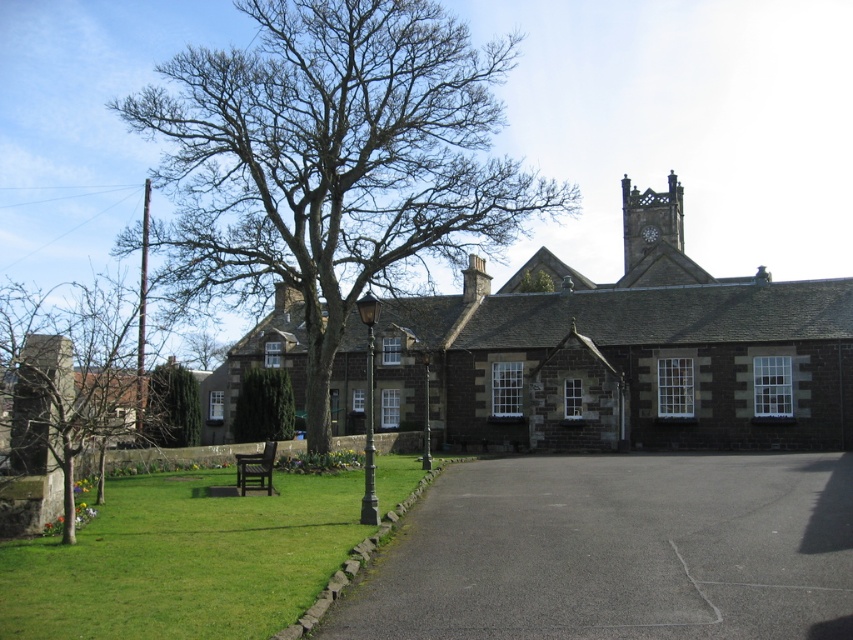
You are standing in front of the historic stone building and want to take a photo that includes both the clock tower and the wooden bench. Which of the two points, point (299,173) or point (596,284), is closer to you when you position yourself to capture both elements in your shot?

Point (299,173) is closer to the camera than point (596,284), so it will appear nearer in your photo when capturing both the clock tower and the wooden bench.

You are a visitor arriving at the historic building and want to park your car on the black asphalt driveway at center. However, there is a bare wood tree at center above it. Is there enough clearance for your car to pass under the tree without hitting the branches?

The black asphalt driveway at center is positioned under the bare wood tree at center, meaning the tree is directly above the driveway. Since the tree is bare, there are no leaves to obstruct, but the branches may still be in the way. However, the description does not provide specific measurements of the tree branches or the height of the car, so it is uncertain if there is enough clearance. It is recommended to check the height of the branches before proceeding.

You are planning to place a new bench in the area. The existing bench is on the grassy lawn to the left. Considering the space available, which object between the bare wood tree at upper left and the green grass at lower left would allow for a wider bench placement?

The bare wood tree at upper left has a greater width than the green grass at lower left, so placing a wider bench would be possible near the bare wood tree at upper left.